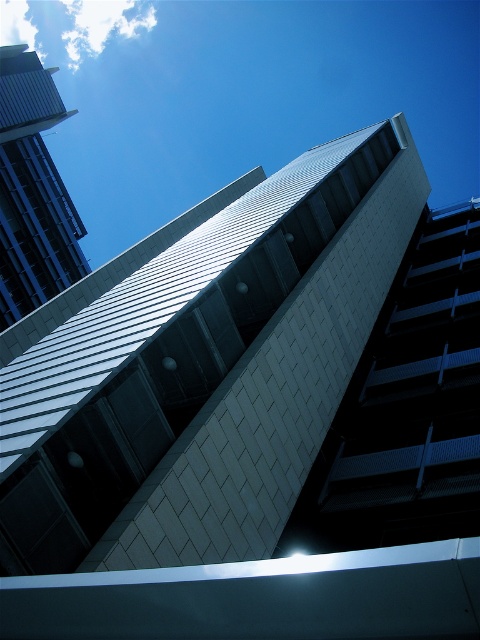
You are standing at the base of the modern architectural structure looking up. There are two points marked on the building, one at coordinates point (x=169, y=401) and the other at point (x=72, y=204). Which point do you see higher up on the building from your perspective?

Point (x=72, y=204) is higher up on the building than point (x=169, y=401) because it is farther from the camera, meaning it appears higher in the viewer perspective.

You are an architect evaluating the structural integrity of the metallic silver building at center and the smooth glass skyscraper at upper left. Based on their sizes, which one might require more robust support systems to withstand strong winds?

The metallic silver building at center requires more robust support systems because it has a larger size compared to the smooth glass skyscraper at upper left, making it more susceptible to wind forces.

You are an architect evaluating the spatial relationship between the two buildings in the image. Given that the metallic silver building at center is shorter than the smooth glass skyscraper at upper left, which one would cast a longer shadow at noon on a sunny day?

The smooth glass skyscraper at upper left would cast a longer shadow because it is taller than the metallic silver building at center.